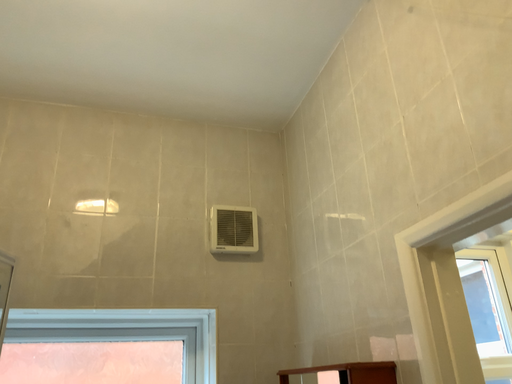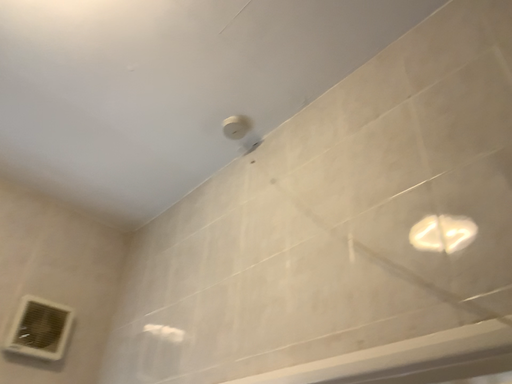
Question: How did the camera likely rotate when shooting the video?

Choices:
 (A) rotated upward
 (B) rotated downward

Answer: (A)